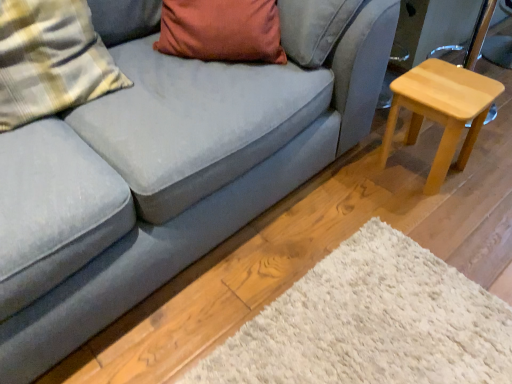
This screenshot has height=384, width=512. In order to click on plaid fabric pillow at left in this screenshot , I will do `click(50, 60)`.

This screenshot has height=384, width=512. What do you see at coordinates (50, 60) in the screenshot?
I see `plaid fabric pillow at left` at bounding box center [50, 60].

The height and width of the screenshot is (384, 512). Describe the element at coordinates (441, 111) in the screenshot. I see `light wood stool at right` at that location.

Identify the location of light wood stool at right. This screenshot has width=512, height=384. (441, 111).

Where is `plaid fabric pillow at left`? plaid fabric pillow at left is located at coordinates (50, 60).

Between light wood stool at right and plaid fabric pillow at left, which one appears on the right side from the viewer's perspective?

light wood stool at right is more to the right.

Is light wood stool at right further to camera compared to plaid fabric pillow at left?

Yes, it is.

Does point (433, 172) come in front of point (28, 64)?

No.

From the image's perspective, would you say light wood stool at right is positioned over plaid fabric pillow at left?

Actually, light wood stool at right appears below plaid fabric pillow at left in the image.

From a real-world perspective, is light wood stool at right positioned above or below plaid fabric pillow at left?

Clearly, from a real-world perspective, light wood stool at right is below plaid fabric pillow at left.

Looking at this image, which of these two, light wood stool at right or plaid fabric pillow at left, is wider?

light wood stool at right is wider.

Is light wood stool at right taller than plaid fabric pillow at left?

No, light wood stool at right is not taller than plaid fabric pillow at left.

Is light wood stool at right bigger than plaid fabric pillow at left?

Incorrect, light wood stool at right is not larger than plaid fabric pillow at left.

Is light wood stool at right surrounding plaid fabric pillow at left?

No, plaid fabric pillow at left is located outside of light wood stool at right.

Would you say light wood stool at right is a long distance from plaid fabric pillow at left?

Yes, light wood stool at right and plaid fabric pillow at left are quite far apart.

Is light wood stool at right oriented away from plaid fabric pillow at left?

No, light wood stool at right's orientation is not away from plaid fabric pillow at left.

Can you tell me how much light wood stool at right and plaid fabric pillow at left differ in facing direction?

2.98 degrees.

Locate an element on the screen. stool behind the plaid fabric pillow at left is located at coordinates (441, 111).

Consider the image. Is plaid fabric pillow at left to the right of light wood stool at right from the viewer's perspective?

Incorrect, plaid fabric pillow at left is not on the right side of light wood stool at right.

Is plaid fabric pillow at left positioned in front of light wood stool at right?

Yes.

Is point (76, 51) positioned in front of point (429, 118)?

That is True.

From the image's perspective, is plaid fabric pillow at left located above or below light wood stool at right?

plaid fabric pillow at left is situated higher than light wood stool at right in the image.

From a real-world perspective, is plaid fabric pillow at left positioned over light wood stool at right based on gravity?

Yes, from a real-world perspective, plaid fabric pillow at left is on top of light wood stool at right.

Does plaid fabric pillow at left have a lesser width compared to light wood stool at right?

Correct, the width of plaid fabric pillow at left is less than that of light wood stool at right.

Considering the relative sizes of plaid fabric pillow at left and light wood stool at right in the image provided, is plaid fabric pillow at left taller than light wood stool at right?

Yes, plaid fabric pillow at left is taller than light wood stool at right.

Looking at this image, who is smaller, plaid fabric pillow at left or light wood stool at right?

light wood stool at right is smaller.

Is light wood stool at right located within plaid fabric pillow at left?

No, light wood stool at right is not surrounded by plaid fabric pillow at left.

Is plaid fabric pillow at left placed right next to light wood stool at right?

No, plaid fabric pillow at left is not next to light wood stool at right.

Is plaid fabric pillow at left positioned with its back to light wood stool at right?

No, plaid fabric pillow at left is not facing the opposite direction of light wood stool at right.

You are a GUI agent. You are given a task and a screenshot of the screen. Output one action in this format:
    pyautogui.click(x=<x>, y=<y>)
    Task: Click on the pillow located above the light wood stool at right (from a real-world perspective)
    The height and width of the screenshot is (384, 512).
    Given the screenshot: What is the action you would take?
    pyautogui.click(x=50, y=60)

Where is `stool below the plaid fabric pillow at left (from a real-world perspective)`? stool below the plaid fabric pillow at left (from a real-world perspective) is located at coordinates (441, 111).

At what (x,y) coordinates should I click in order to perform the action: click on stool below the plaid fabric pillow at left (from the image's perspective). Please return your answer as a coordinate pair (x, y). Looking at the image, I should click on (441, 111).